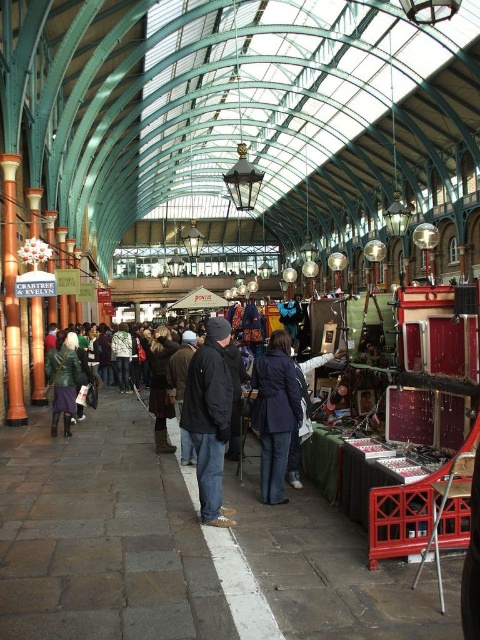
You are a customer in the market and want to decide which coat to try on first. The navy blue fabric coat at center and the green leather jacket at lower left are both on display. Based on their sizes, which one might require more space to try on?

The navy blue fabric coat at center is taller than the green leather jacket at lower left, so it might require more space to try on.

You are a customer at the market and want to buy a jacket. You see the leather jacket at center and the green leather jacket at lower left. Which one is thinner?

The leather jacket at center is thinner than the green leather jacket at lower left.